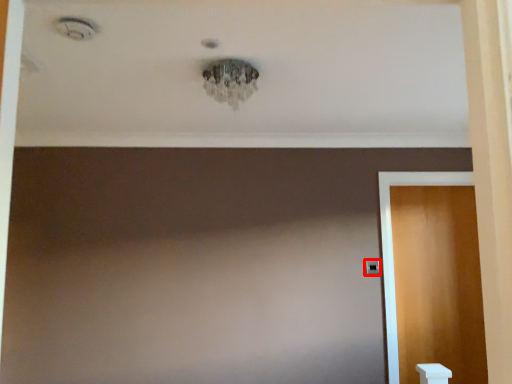
Question: In this image, where is door handle (annotated by the red box) located relative to door?

Choices:
 (A) right
 (B) left

Answer: (B)